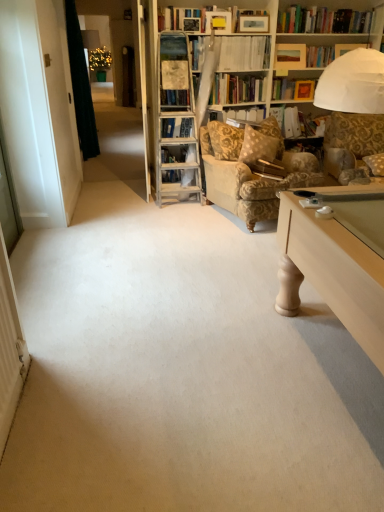
Locate an element on the screen. This screenshot has height=512, width=384. gold-patterned fabric armchair at center-right is located at coordinates (250, 173).

The height and width of the screenshot is (512, 384). Identify the location of dark green fabric at left. (81, 85).

Measure the distance between hardcover book at center, the first book positioned from the bottom, and camera.

hardcover book at center, the first book positioned from the bottom, is 3.58 meters away from camera.

The image size is (384, 512). What do you see at coordinates (243, 53) in the screenshot? I see `hardcover book at upper center, positioned as the 3th book in bottom-to-top order` at bounding box center [243, 53].

Measure the distance between point (225, 63) and camera.

13.78 feet.

This screenshot has width=384, height=512. Identify the location of gold-patterned fabric armchair at center-right. (250, 173).

Between dark green fabric at left and hardcover book at center, which appears as the third book when viewed from the back, which one appears on the right side from the viewer's perspective?

hardcover book at center, which appears as the third book when viewed from the back.

Is dark green fabric at left oriented away from hardcover book at center, the third book viewed from the top?

No.

From a real-world perspective, is dark green fabric at left physically below hardcover book at center, which appears as the third book when viewed from the back?

No, from a real-world perspective, dark green fabric at left is not under hardcover book at center, which appears as the third book when viewed from the back.

Would you say dark green fabric at left is inside or outside fluffy beige pillow at right?

The correct answer is: outside.

Is the position of dark green fabric at left less distant than that of fluffy beige pillow at right?

No, the depth of dark green fabric at left is greater than that of fluffy beige pillow at right.

Does dark green fabric at left have a smaller size compared to fluffy beige pillow at right?

Incorrect, dark green fabric at left is not smaller in size than fluffy beige pillow at right.

From a real-world perspective, who is located lower, dark green fabric at left or fluffy beige pillow at right?

From a 3D spatial view, fluffy beige pillow at right is below.

Is there a large distance between hardcover book at center, the first book positioned from the bottom, and hardcover book at upper center, positioned as the 3th book in bottom-to-top order?

That's right, there is a large distance between hardcover book at center, the first book positioned from the bottom, and hardcover book at upper center, positioned as the 3th book in bottom-to-top order.

Is hardcover book at center, the first book positioned from the bottom, looking in the opposite direction of hardcover book at upper center, placed as the 1th book when sorted from top to bottom?

That's not correct — hardcover book at center, the first book positioned from the bottom, is not looking away from hardcover book at upper center, placed as the 1th book when sorted from top to bottom.

Where is `book that is in front of the hardcover book at upper center, the 2th book from the back`? Image resolution: width=384 pixels, height=512 pixels. book that is in front of the hardcover book at upper center, the 2th book from the back is located at coordinates (269, 168).

Is hardcover book at center, which appears as the third book when viewed from the back, to the left of hardcover book at upper center, positioned as the 3th book in bottom-to-top order, from the viewer's perspective?

No, hardcover book at center, which appears as the third book when viewed from the back, is not to the left of hardcover book at upper center, positioned as the 3th book in bottom-to-top order.

Is gold-patterned fabric armchair at center-right at the right side of hardcover book at upper center, which is counted as the 2th book, starting from the front?

Yes.

Considering the sizes of objects gold-patterned fabric armchair at center-right and hardcover book at upper center, positioned as the 3th book in bottom-to-top order, in the image provided, who is wider, gold-patterned fabric armchair at center-right or hardcover book at upper center, positioned as the 3th book in bottom-to-top order,?

gold-patterned fabric armchair at center-right is wider.

Is hardcover book at upper center, placed as the 1th book when sorted from top to bottom, at the back of gold-patterned fabric armchair at center-right?

No, gold-patterned fabric armchair at center-right's orientation is not away from hardcover book at upper center, placed as the 1th book when sorted from top to bottom.

Does gold-patterned fabric armchair at center-right have a smaller size compared to hardcover book at upper center, positioned as the 3th book in bottom-to-top order?

Actually, gold-patterned fabric armchair at center-right might be larger than hardcover book at upper center, positioned as the 3th book in bottom-to-top order.

From the image's perspective, which one is positioned higher, gold-patterned fabric armchair at center-right or fluffy beige pillow at right?

fluffy beige pillow at right appears higher in the image.

Consider the image. Which is more to the left, gold-patterned fabric armchair at center-right or fluffy beige pillow at right?

Positioned to the left is gold-patterned fabric armchair at center-right.

In terms of width, does gold-patterned fabric armchair at center-right look wider or thinner when compared to fluffy beige pillow at right?

Clearly, gold-patterned fabric armchair at center-right has more width compared to fluffy beige pillow at right.

Is gold-patterned fabric armchair at center-right located outside fluffy beige pillow at right?

Yes, gold-patterned fabric armchair at center-right is located beyond the bounds of fluffy beige pillow at right.

Starting from the gold-patterned fabric armchair at center-right, which book is the 3rd one behind? Please provide its 2D coordinates.

[(297, 122)]

Is white paper folder at upper center, the 1th book viewed from the back, shorter than gold-patterned fabric armchair at center-right?

Yes.

Is white paper folder at upper center, the 3th book when ordered from front to back, located outside gold-patterned fabric armchair at center-right?

Absolutely, white paper folder at upper center, the 3th book when ordered from front to back, is external to gold-patterned fabric armchair at center-right.

Is fluffy beige pillow at right at the back of hardcover book at upper center, which is counted as the 2th book, starting from the front?

No.

Considering the sizes of objects hardcover book at upper center, placed as the 1th book when sorted from top to bottom, and fluffy beige pillow at right in the image provided, who is shorter, hardcover book at upper center, placed as the 1th book when sorted from top to bottom, or fluffy beige pillow at right?

With less height is fluffy beige pillow at right.

Choose the correct answer: Is hardcover book at upper center, placed as the 1th book when sorted from top to bottom, inside fluffy beige pillow at right or outside it?

hardcover book at upper center, placed as the 1th book when sorted from top to bottom, is spatially situated outside fluffy beige pillow at right.

Considering the positions of point (239, 58) and point (382, 175), is point (239, 58) closer or farther from the camera than point (382, 175)?

Point (239, 58) is farther from the camera than point (382, 175).

This screenshot has height=512, width=384. What are the coordinates of `curtain that appears above the hardcover book at center, which appears as the third book when viewed from the back (from a real-world perspective)` in the screenshot? It's located at (81, 85).

Where is `curtain located above the fluffy beige pillow at right (from the image's perspective)`? The image size is (384, 512). curtain located above the fluffy beige pillow at right (from the image's perspective) is located at coordinates (81, 85).

Based on their spatial positions, is hardcover book at upper center, positioned as the 3th book in bottom-to-top order, or fluffy beige pillow at right closer to white paper folder at upper center, acting as the second book starting from the bottom?

hardcover book at upper center, positioned as the 3th book in bottom-to-top order, is positioned closer to the anchor white paper folder at upper center, acting as the second book starting from the bottom.

Consider the image. Based on their spatial positions, is fluffy beige pillow at right or gold-patterned fabric armchair at center-right further from hardcover book at upper center, positioned as the 3th book in bottom-to-top order?

Among the two, fluffy beige pillow at right is located further to hardcover book at upper center, positioned as the 3th book in bottom-to-top order.

From the image, which object appears to be farther from hardcover book at upper center, which is counted as the 2th book, starting from the front, gold-patterned fabric armchair at center-right or hardcover book at center, the first book positioned from the bottom?

Among the two, hardcover book at center, the first book positioned from the bottom, is located further to hardcover book at upper center, which is counted as the 2th book, starting from the front.

Estimate the real-world distances between objects in this image. Which object is further from hardcover book at center, which appears as the third book when viewed from the back, dark green fabric at left or gold-patterned fabric armchair at center-right?

dark green fabric at left lies further to hardcover book at center, which appears as the third book when viewed from the back, than the other object.

Looking at the image, which one is located further to white paper folder at upper center, the 3th book when ordered from front to back, dark green fabric at left or fluffy beige pillow at right?

dark green fabric at left lies further to white paper folder at upper center, the 3th book when ordered from front to back, than the other object.

Estimate the real-world distances between objects in this image. Which object is further from white paper folder at upper center, which appears as the second book when viewed from the top, gold-patterned fabric armchair at center-right or hardcover book at upper center, the 2th book from the back?

Among the two, gold-patterned fabric armchair at center-right is located further to white paper folder at upper center, which appears as the second book when viewed from the top.

Considering their positions, is gold-patterned fabric armchair at center-right positioned further to fluffy beige pillow at right than hardcover book at center, which appears as the third book when viewed from the back?

The object further to fluffy beige pillow at right is gold-patterned fabric armchair at center-right.

Looking at the image, which one is located further to fluffy beige pillow at right, white paper folder at upper center, the 1th book viewed from the back, or dark green fabric at left?

Based on the image, dark green fabric at left appears to be further to fluffy beige pillow at right.

The image size is (384, 512). Identify the location of chair between hardcover book at upper center, the 2th book from the back, and hardcover book at center, placed as the 1th book when sorted from front to back, in the vertical direction. (250, 173).

I want to click on book between hardcover book at upper center, positioned as the 3th book in bottom-to-top order, and gold-patterned fabric armchair at center-right from top to bottom, so click(x=297, y=122).

Image resolution: width=384 pixels, height=512 pixels. I want to click on chair located between hardcover book at upper center, placed as the 1th book when sorted from top to bottom, and fluffy beige pillow at right in the left-right direction, so click(x=250, y=173).

Find the location of a particular element. This screenshot has width=384, height=512. pillow between gold-patterned fabric armchair at center-right and white paper folder at upper center, acting as the second book starting from the bottom, from front to back is located at coordinates (375, 164).